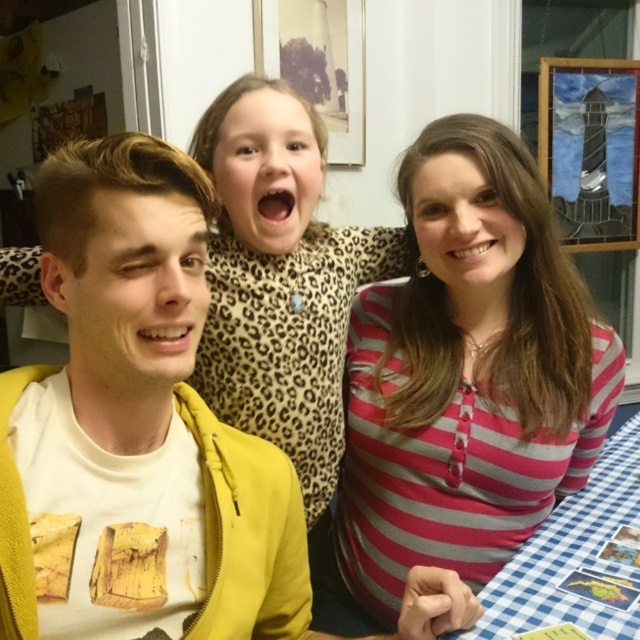
Based on the photo, can you confirm if leopard print sweater at center is positioned to the right of blue checkered tablecloth at lower right?

No, leopard print sweater at center is not to the right of blue checkered tablecloth at lower right.

Which is in front, point (216, 259) or point (528, 582)?

Point (528, 582)

Is point (280, 147) behind point (589, 561)?

That is False.

This screenshot has width=640, height=640. In order to click on leopard print sweater at center in this screenshot , I will do `click(280, 280)`.

How much distance is there between pink striped shirt at center and leopard print sweater at center?

8.29 inches

Between point (420, 509) and point (385, 252), which one is positioned in front?

Positioned in front is point (420, 509).

Find the location of a particular element. pink striped shirt at center is located at coordinates (467, 372).

Who is higher up, yellow zip-up jacket at left or leopard print sweater at center?

Positioned higher is leopard print sweater at center.

Describe the element at coordinates (136, 428) in the screenshot. The width and height of the screenshot is (640, 640). I see `yellow zip-up jacket at left` at that location.

You are a GUI agent. You are given a task and a screenshot of the screen. Output one action in this format:
    pyautogui.click(x=<x>, y=<y>)
    Task: Click on the yellow zip-up jacket at left
    The height and width of the screenshot is (640, 640).
    Given the screenshot: What is the action you would take?
    pyautogui.click(x=136, y=428)